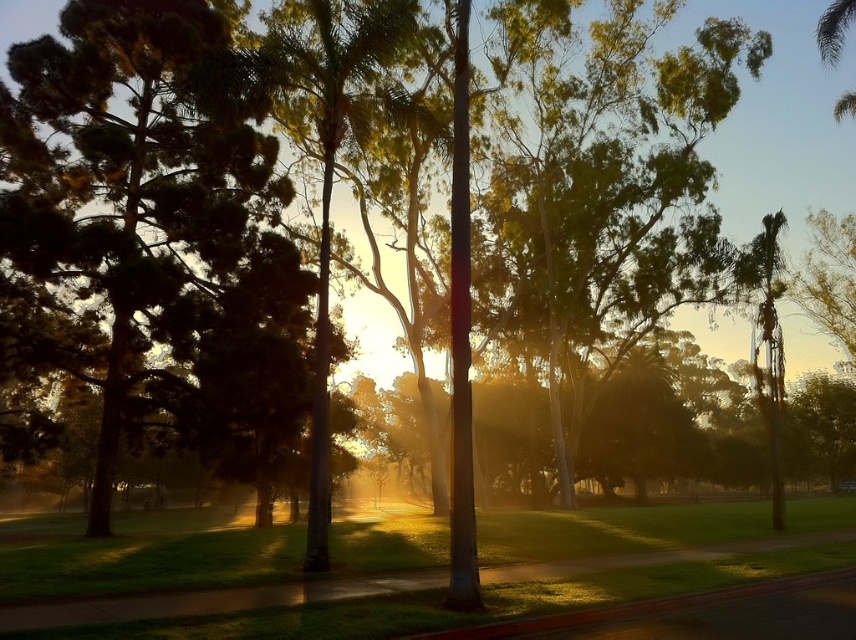
You are standing at the entrance of the park and want to reach the green leafy palm tree at center. According to the coordinates provided, in which direction should you walk from your current position to reach it?

The green leafy palm tree at center is located at coordinates point (x=333, y=147). Since you are at the entrance, you should walk towards the center of the park where the palm tree is positioned based on the coordinates provided.

You are standing on the paved pathway in the park and want to walk towards the green leafy palm tree at center and the green leafy palm tree at right. Which palm tree will you reach first?

The green leafy palm tree at center is in front of the green leafy palm tree at right, so you will reach the green leafy palm tree at center first because it is closer to you.

You are a park visitor standing on the paved pathway and want to take a photo of the green leafy palm tree at center and the green leafy palm tree at right. Which tree should you position yourself closer to in order to capture both trees in the same frame without moving your camera?

The green leafy palm tree at center is positioned over the green leafy palm tree at right, so you should position yourself closer to the green leafy palm tree at right to include both trees in the frame.